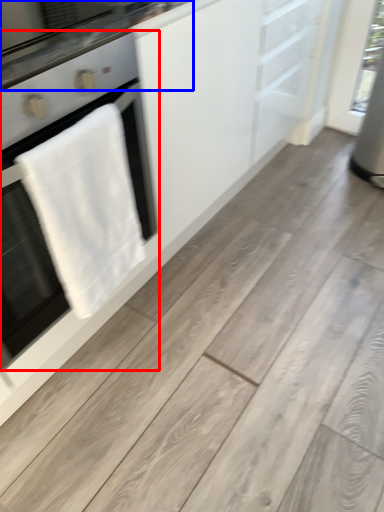
Question: Which object is closer to the camera taking this photo, home appliance (highlighted by a red box) or countertop (highlighted by a blue box)?

Choices:
 (A) home appliance
 (B) countertop

Answer: (A)